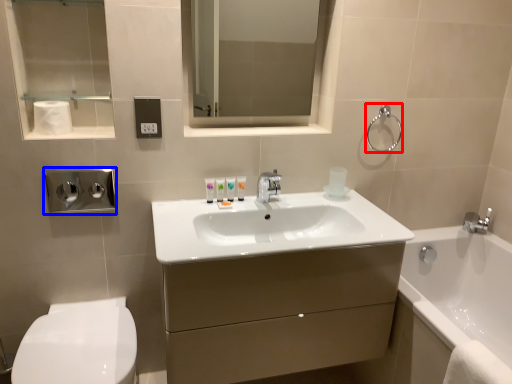
Question: Which point is further to the camera, towel bar (highlighted by a red box) or dispenser (highlighted by a blue box)?

Choices:
 (A) towel bar
 (B) dispenser

Answer: (A)